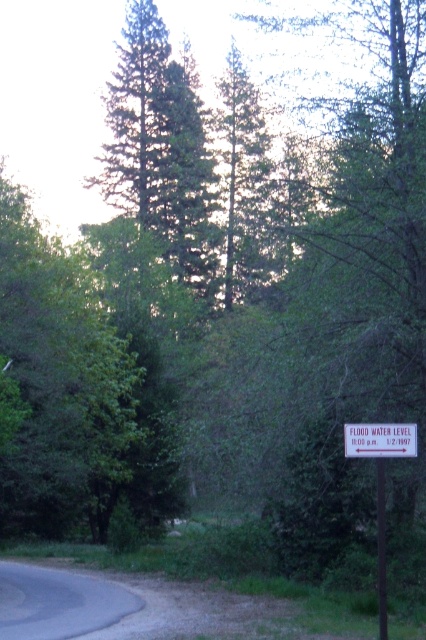
Question: From the image, what is the correct spatial relationship of white plastic sign at lower right in relation to metallic signpost at right?

Choices:
 (A) left
 (B) right

Answer: (A)

Question: Is white plastic sign at lower right above metallic signpost at right?

Choices:
 (A) no
 (B) yes

Answer: (A)

Question: Which of the following is the farthest from the observer?

Choices:
 (A) white plastic sign at lower right
 (B) metallic signpost at right

Answer: (B)

Question: Is white plastic sign at lower right above metallic signpost at right?

Choices:
 (A) no
 (B) yes

Answer: (A)